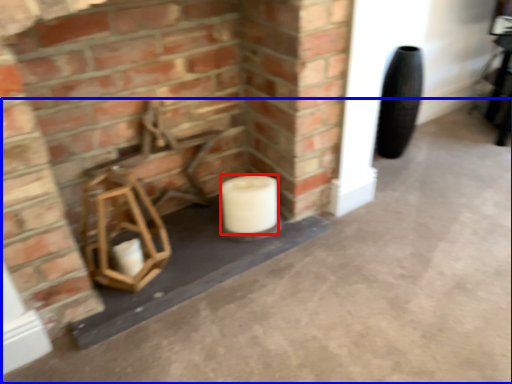
Question: Which point is closer to the camera, toilet paper (highlighted by a red box) or concrete (highlighted by a blue box)?

Choices:
 (A) toilet paper
 (B) concrete

Answer: (B)